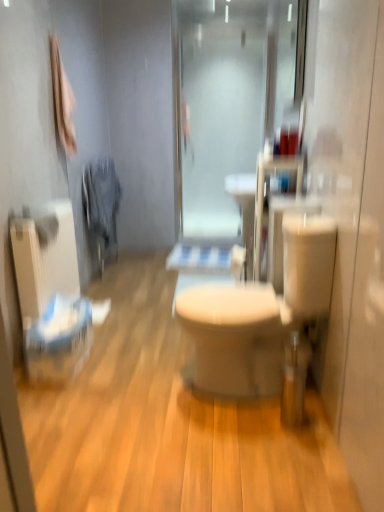
Question: Could you tell me if frosted glass shower door at center is turned towards white glossy toilet at center?

Choices:
 (A) no
 (B) yes

Answer: (B)

Question: Is white glossy toilet at center at the back of frosted glass shower door at center?

Choices:
 (A) no
 (B) yes

Answer: (A)

Question: Does frosted glass shower door at center have a lesser height compared to white glossy toilet at center?

Choices:
 (A) no
 (B) yes

Answer: (A)

Question: Is frosted glass shower door at center next to white glossy toilet at center?

Choices:
 (A) no
 (B) yes

Answer: (A)

Question: From the image's perspective, is frosted glass shower door at center beneath white glossy toilet at center?

Choices:
 (A) yes
 (B) no

Answer: (B)

Question: Is point (21, 307) positioned closer to the camera than point (240, 276)?

Choices:
 (A) farther
 (B) closer

Answer: (B)

Question: Is white textured radiator at left in front of or behind white matte toilet paper at center in the image?

Choices:
 (A) front
 (B) behind

Answer: (A)

Question: From a real-world perspective, is white textured radiator at left physically located above or below white matte toilet paper at center?

Choices:
 (A) below
 (B) above

Answer: (A)

Question: Is white textured radiator at left wider or thinner than white matte toilet paper at center?

Choices:
 (A) thin
 (B) wide

Answer: (B)

Question: From the image's perspective, is frosted glass shower door at center located above or below white glossy toilet at center?

Choices:
 (A) below
 (B) above

Answer: (B)

Question: Is frosted glass shower door at center to the left or to the right of white glossy toilet at center in the image?

Choices:
 (A) left
 (B) right

Answer: (B)

Question: Is frosted glass shower door at center spatially inside white glossy toilet at center, or outside of it?

Choices:
 (A) outside
 (B) inside

Answer: (A)

Question: Is frosted glass shower door at center taller or shorter than white glossy toilet at center?

Choices:
 (A) short
 (B) tall

Answer: (B)

Question: In terms of height, does white glossy toilet at center look taller or shorter compared to white matte toilet paper at center?

Choices:
 (A) short
 (B) tall

Answer: (A)

Question: Is point (324, 420) positioned closer to the camera than point (236, 267)?

Choices:
 (A) closer
 (B) farther

Answer: (A)